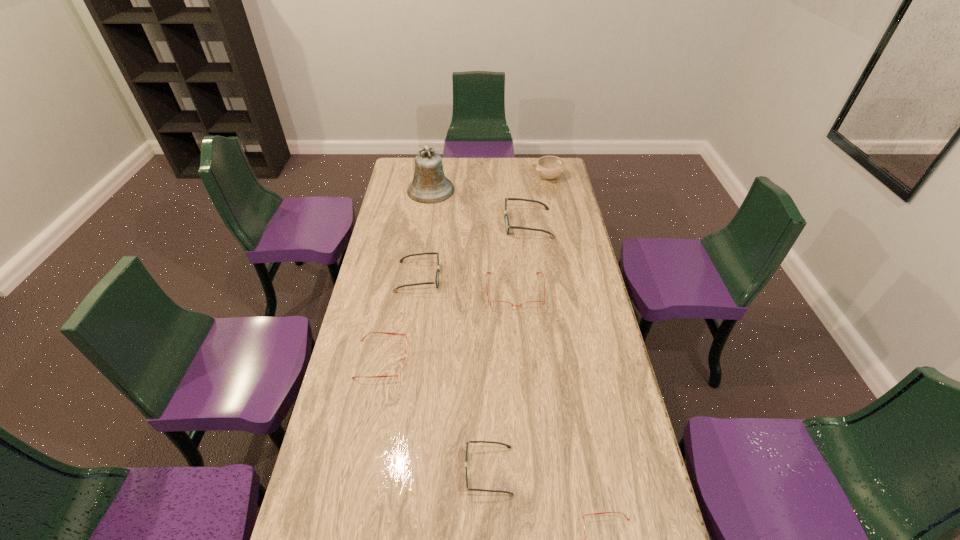
What are the coordinates of `pink spectacles identified as the closest to the biggest pink spectacles` in the screenshot? It's located at (402, 367).

Locate an element on the screen. Image resolution: width=960 pixels, height=540 pixels. free region that satisfies the following two spatial constraints: 1. on the face of the rightmost gray spectacles; 2. on the lenses of the farthest pink spectacles is located at coordinates (537, 292).

At what (x,y) coordinates should I click in order to perform the action: click on vacant area that satisfies the following two spatial constraints: 1. on the lenses of the biggest pink spectacles; 2. on the face of the nearest gray spectacles. Please return your answer as a coordinate pair (x, y). Looking at the image, I should click on (529, 471).